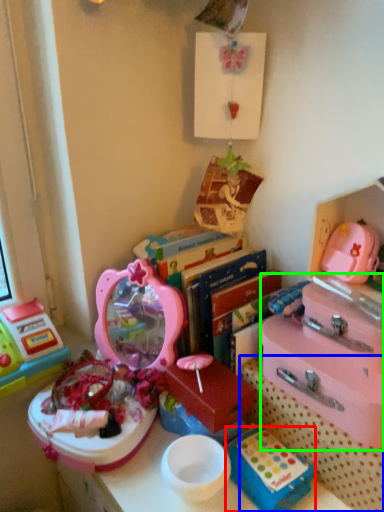
Question: Which object is positioned farthest from storage box (highlighted by a red box)? Select from storage box (highlighted by a blue box) and storage box (highlighted by a green box).

Choices:
 (A) storage box
 (B) storage box

Answer: (B)